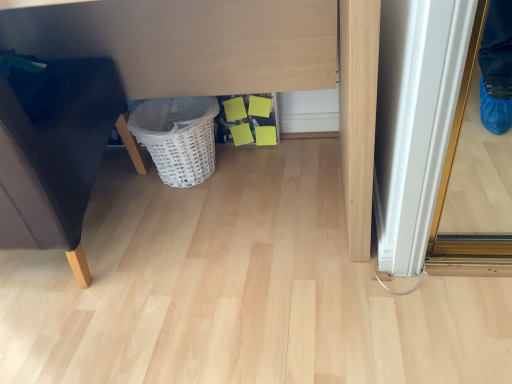
Question: Can you confirm if matte white vanity at center is taller than white wicker basket at lower center?

Choices:
 (A) no
 (B) yes

Answer: (B)

Question: Can you confirm if matte white vanity at center is bigger than white wicker basket at lower center?

Choices:
 (A) yes
 (B) no

Answer: (A)

Question: Is matte white vanity at center positioned behind white wicker basket at lower center?

Choices:
 (A) no
 (B) yes

Answer: (A)

Question: From the image's perspective, is matte white vanity at center below white wicker basket at lower center?

Choices:
 (A) yes
 (B) no

Answer: (B)

Question: From a real-world perspective, is matte white vanity at center over white wicker basket at lower center?

Choices:
 (A) yes
 (B) no

Answer: (A)

Question: Is matte white vanity at center outside white wicker basket at lower center?

Choices:
 (A) yes
 (B) no

Answer: (A)

Question: Considering the relative sizes of matte black sofa at left and white wicker basket at lower center in the image provided, is matte black sofa at left taller than white wicker basket at lower center?

Choices:
 (A) yes
 (B) no

Answer: (A)

Question: Does matte black sofa at left come in front of white wicker basket at lower center?

Choices:
 (A) yes
 (B) no

Answer: (A)

Question: Is matte black sofa at left turned away from white wicker basket at lower center?

Choices:
 (A) no
 (B) yes

Answer: (A)

Question: Is matte black sofa at left thinner than white wicker basket at lower center?

Choices:
 (A) yes
 (B) no

Answer: (B)

Question: Is matte black sofa at left next to white wicker basket at lower center?

Choices:
 (A) no
 (B) yes

Answer: (A)

Question: Can you confirm if matte black sofa at left is smaller than white wicker basket at lower center?

Choices:
 (A) no
 (B) yes

Answer: (A)

Question: Is white wicker basket at lower center beside matte white vanity at center?

Choices:
 (A) no
 (B) yes

Answer: (A)